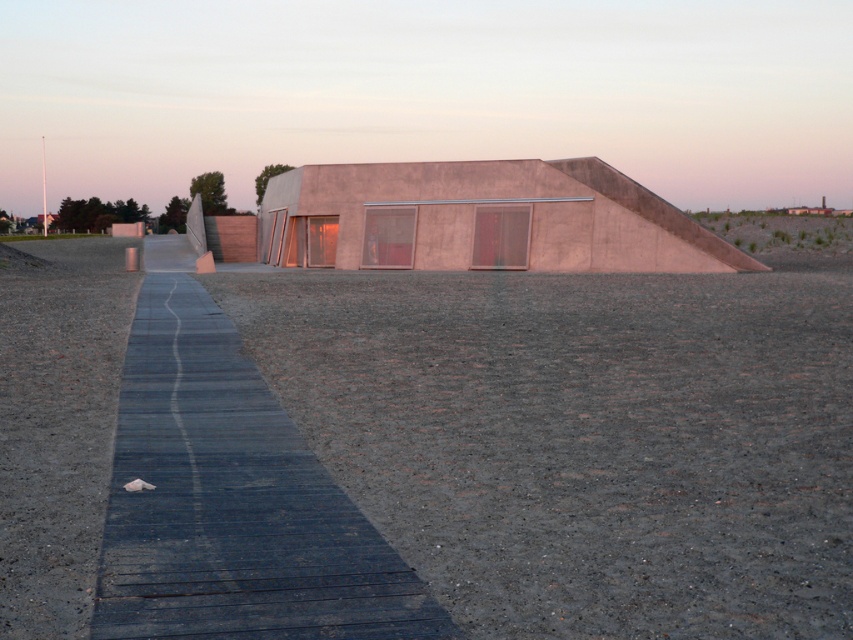
Question: Is gray gravel at center wider than dark gray wooden path at center?

Choices:
 (A) yes
 (B) no

Answer: (A)

Question: Which object appears farthest from the camera in this image?

Choices:
 (A) gray gravel at center
 (B) dark gray wooden path at center

Answer: (A)

Question: Does gray gravel at center appear on the right side of dark gray wooden path at center?

Choices:
 (A) no
 (B) yes

Answer: (B)

Question: Does gray gravel at center appear on the left side of dark gray wooden path at center?

Choices:
 (A) no
 (B) yes

Answer: (A)

Question: Among these points, which one is nearest to the camera?

Choices:
 (A) (241, 316)
 (B) (148, 577)

Answer: (B)

Question: Which of the following is the farthest from the observer?

Choices:
 (A) (209, 524)
 (B) (756, 465)

Answer: (B)